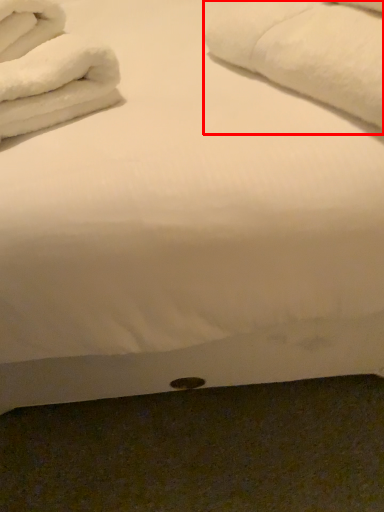
Question: Observing the image, what is the correct spatial positioning of bath towel (annotated by the red box) in reference to bath towel?

Choices:
 (A) left
 (B) right

Answer: (B)